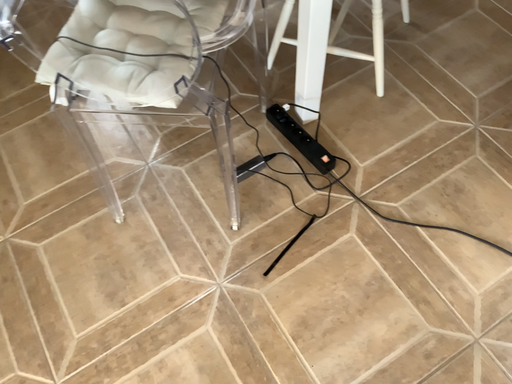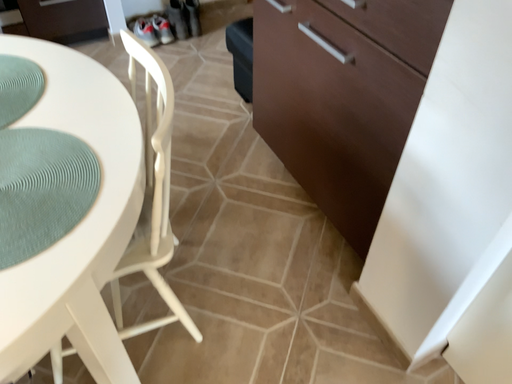
Question: Which way did the camera rotate in the video?

Choices:
 (A) rotated upward
 (B) rotated downward

Answer: (A)